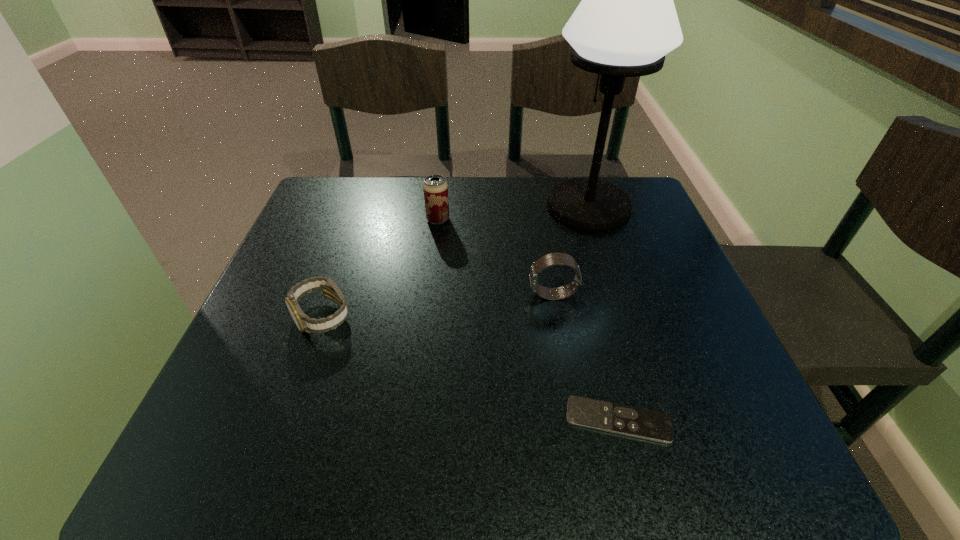
Locate an element on the screen. free region located 0.340m on the face of the taller watch is located at coordinates (363, 295).

At what (x,y) coordinates should I click in order to perform the action: click on free region located 0.380m on the face of the taller watch. Please return your answer as a coordinate pair (x, y). This screenshot has width=960, height=540. Looking at the image, I should click on (344, 295).

Locate an element on the screen. This screenshot has height=540, width=960. vacant region located on the face of the left watch is located at coordinates (276, 449).

Identify the location of free space located 0.240m on the back of the remote control. The height and width of the screenshot is (540, 960). (587, 295).

This screenshot has width=960, height=540. Identify the location of table lamp present at the far edge. (626, 23).

This screenshot has width=960, height=540. Find the location of `beer can present at the far edge`. beer can present at the far edge is located at coordinates (435, 188).

Locate an element on the screen. object present at the near edge is located at coordinates (642, 423).

At what (x,y) coordinates should I click in order to perform the action: click on object located in the left edge section of the desktop. Please return your answer as a coordinate pair (x, y). The image size is (960, 540). Looking at the image, I should click on (330, 290).

Identify the location of table lamp that is at the right edge. Image resolution: width=960 pixels, height=540 pixels. (626, 23).

The width and height of the screenshot is (960, 540). What are the coordinates of `remote control positioned at the right edge` in the screenshot? It's located at (642, 423).